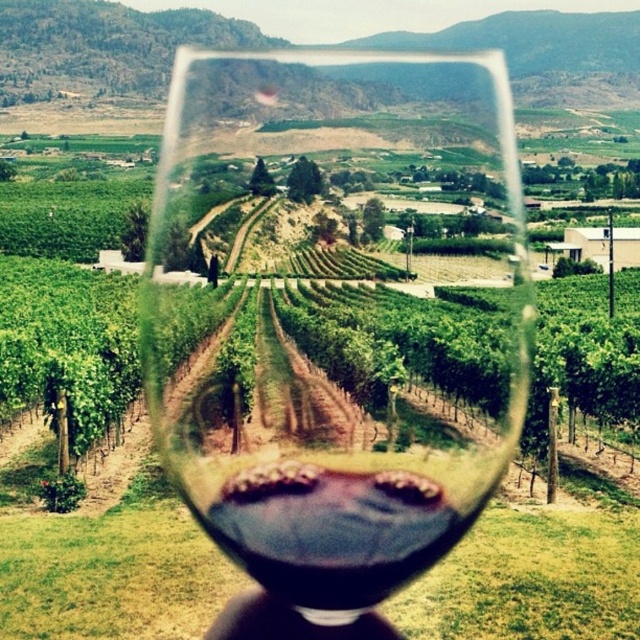
You are holding a wine glass and looking through it at the vineyard scene. There is a point at coordinates (330, 323). What object is located at that point?

The point at coordinates (330, 323) corresponds to the transparent glass at center.

You are holding a wine glass filled with dark red liquid at center and notice your hand, labeled as black matte hand at lower center, is positioned below it. Based on the scene, can you determine if the liquid in the glass might spill onto your hand?

The dark red liquid at center is taller than the black matte hand at lower center, meaning the liquid level is higher than the hand. If the glass is tilted, the liquid could spill onto the hand.